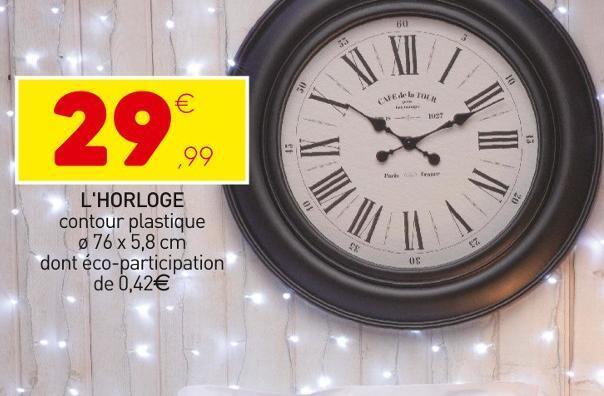
The height and width of the screenshot is (396, 604). What are the coordinates of `white light` in the screenshot? It's located at (140, 352).